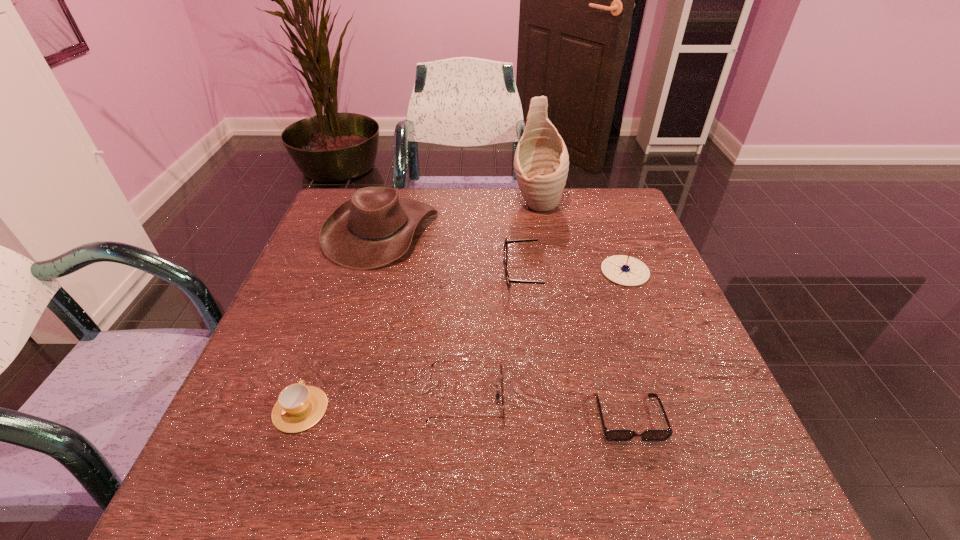
Locate an element on the screen. The width and height of the screenshot is (960, 540). free space between the right sunglasses and the spectacles is located at coordinates coord(575,346).

Where is `blank region between the second tallest object and the compass`? Image resolution: width=960 pixels, height=540 pixels. blank region between the second tallest object and the compass is located at coordinates (503, 251).

Image resolution: width=960 pixels, height=540 pixels. I want to click on empty space that is in between the pitcher and the cup, so click(419, 307).

Locate an element on the screen. Image resolution: width=960 pixels, height=540 pixels. vacant space that's between the cup and the tallest object is located at coordinates (419, 307).

Where is `vacant point located between the compass and the right sunglasses`? vacant point located between the compass and the right sunglasses is located at coordinates (627, 345).

This screenshot has height=540, width=960. I want to click on empty location between the third object from left to right and the compass, so click(545, 334).

Locate an element on the screen. Image resolution: width=960 pixels, height=540 pixels. free spot between the spectacles and the left sunglasses is located at coordinates (493, 336).

The width and height of the screenshot is (960, 540). I want to click on vacant area that lies between the compass and the fifth object from right to left, so click(x=545, y=334).

Identify the location of free space between the cup and the compass. This screenshot has height=540, width=960. (463, 340).

Identify the location of object that stands as the fourth closest to the spectacles. The height and width of the screenshot is (540, 960). (501, 373).